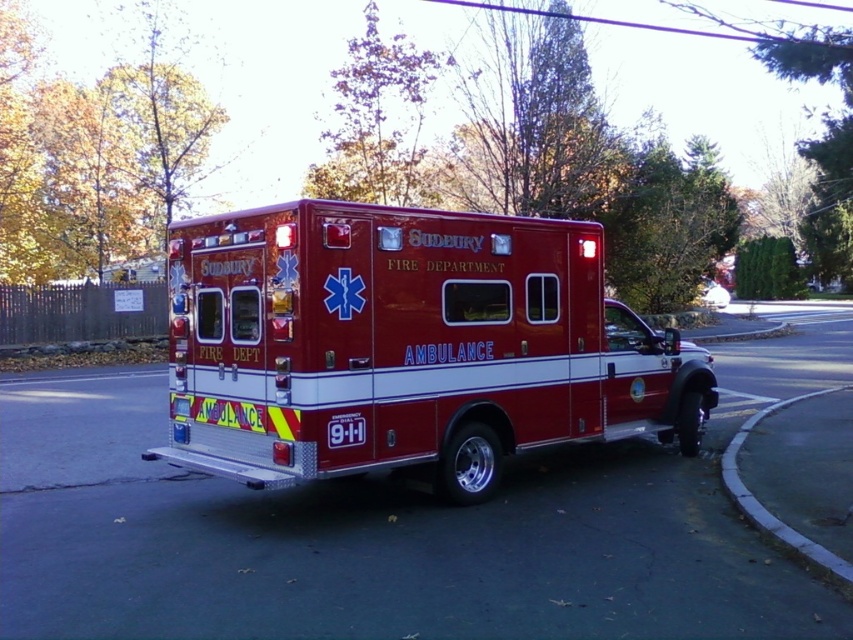
Measure the distance between point [413,460] and camera.

The distance of point [413,460] from camera is 21.77 feet.

Which is in front, point (286, 388) or point (730, 449)?

Point (286, 388) is more forward.

The width and height of the screenshot is (853, 640). Identify the location of shiny red ambulance at center. (405, 346).